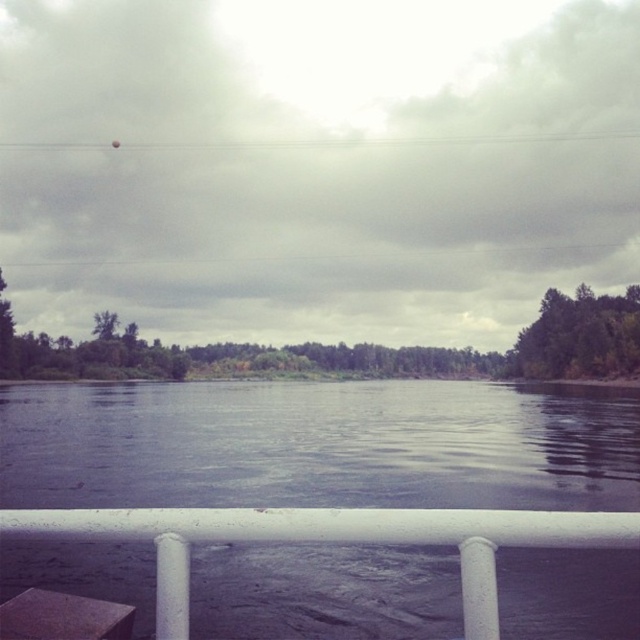
Who is higher up, white matte rail at lower center or green matte tree at upper center?

Positioned higher is green matte tree at upper center.

Is the position of white matte rail at lower center less distant than that of green matte tree at upper center?

That is True.

Who is more distant from viewer, [573,532] or [96,328]?

Point [96,328]

At what (x,y) coordinates should I click in order to perform the action: click on white matte rail at lower center. Please return your answer as a coordinate pair (x, y). Looking at the image, I should click on (332, 541).

Where is `green matte tree at right`? This screenshot has height=640, width=640. green matte tree at right is located at coordinates (579, 337).

Consider the image. Which is above, green matte tree at right or green matte tree at upper center?

green matte tree at right is higher up.

What do you see at coordinates (579, 337) in the screenshot? I see `green matte tree at right` at bounding box center [579, 337].

Image resolution: width=640 pixels, height=640 pixels. I want to click on green matte tree at right, so click(579, 337).

Can you confirm if white matte rail at lower center is positioned to the right of green matte tree at right?

Incorrect, white matte rail at lower center is not on the right side of green matte tree at right.

Is the position of white matte rail at lower center more distant than that of green matte tree at right?

That is False.

Who is more distant from viewer, (524, 518) or (564, 323)?

Point (564, 323)

Where is `white matte rail at lower center`? white matte rail at lower center is located at coordinates (332, 541).